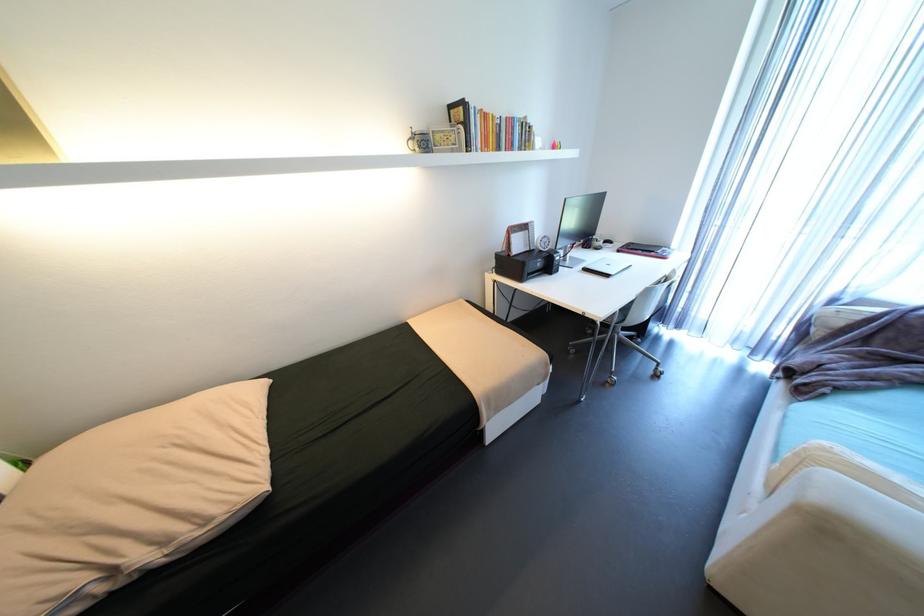
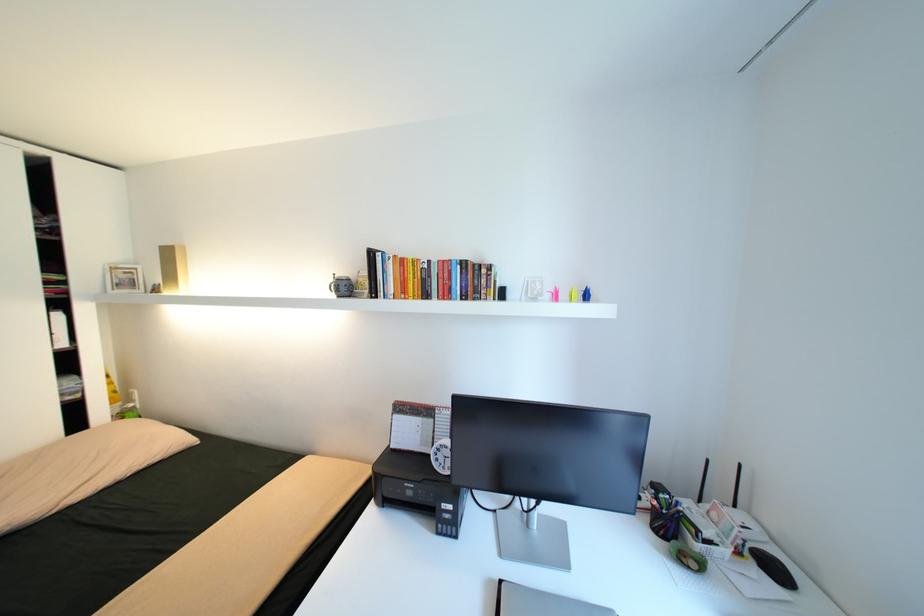
The point at (514, 118) is marked in the first image. Where is the corresponding point in the second image?

(445, 262)